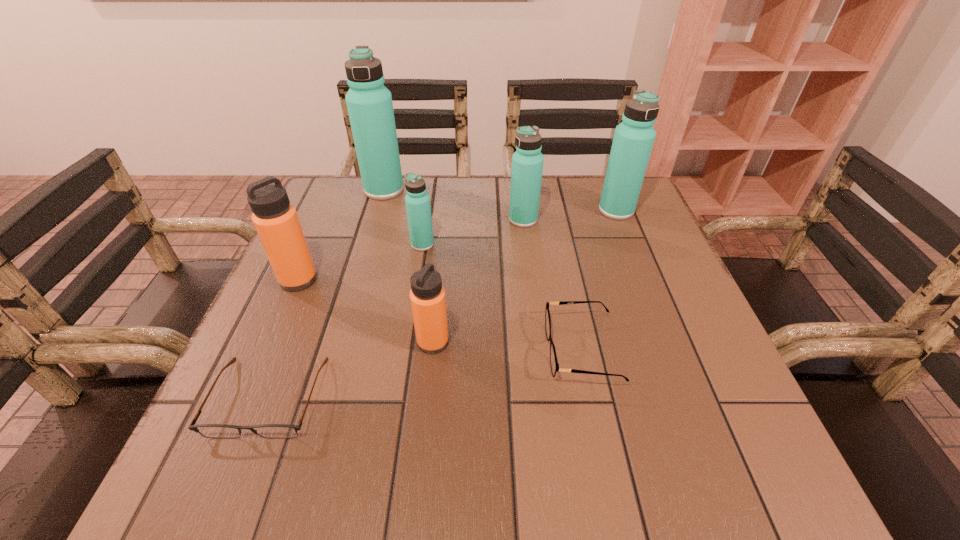
This screenshot has height=540, width=960. Find the location of `vacant position located 0.190m on the front of the fourth farthest object`. vacant position located 0.190m on the front of the fourth farthest object is located at coordinates coord(412,313).

Locate an element on the screen. This screenshot has height=540, width=960. vacant space located on the back of the smaller orange thermos bottle is located at coordinates (436, 307).

You are a GUI agent. You are given a task and a screenshot of the screen. Output one action in this format:
    pyautogui.click(x=<x>, y=<y>)
    Task: Click on the vacant space located on the front-facing side of the right spectacles
    The image size is (960, 540).
    Given the screenshot: What is the action you would take?
    pyautogui.click(x=340, y=350)

Identify the location of vacant space located 0.240m on the front-facing side of the right spectacles. The image size is (960, 540). (417, 350).

You are a GUI agent. You are given a task and a screenshot of the screen. Output one action in this format:
    pyautogui.click(x=<x>, y=<y>)
    Task: Click on the vacant region located 0.050m on the front-facing side of the right spectacles
    This screenshot has height=540, width=960.
    Given the screenshot: What is the action you would take?
    pyautogui.click(x=520, y=350)

Locate an element on the screen. vacant space located on the front-facing side of the left spectacles is located at coordinates tap(235, 479).

Where is `object located at the near edge`? The image size is (960, 540). object located at the near edge is located at coordinates (222, 431).

You are a GUI agent. You are given a task and a screenshot of the screen. Output one action in this format:
    pyautogui.click(x=<x>, y=<y>)
    Task: Click on the spectacles present at the left edge
    
    Given the screenshot: What is the action you would take?
    pyautogui.click(x=222, y=431)

The width and height of the screenshot is (960, 540). In order to click on object that is at the right edge in this screenshot , I will do `click(633, 140)`.

Where is `object that is at the far left corner`? object that is at the far left corner is located at coordinates (369, 103).